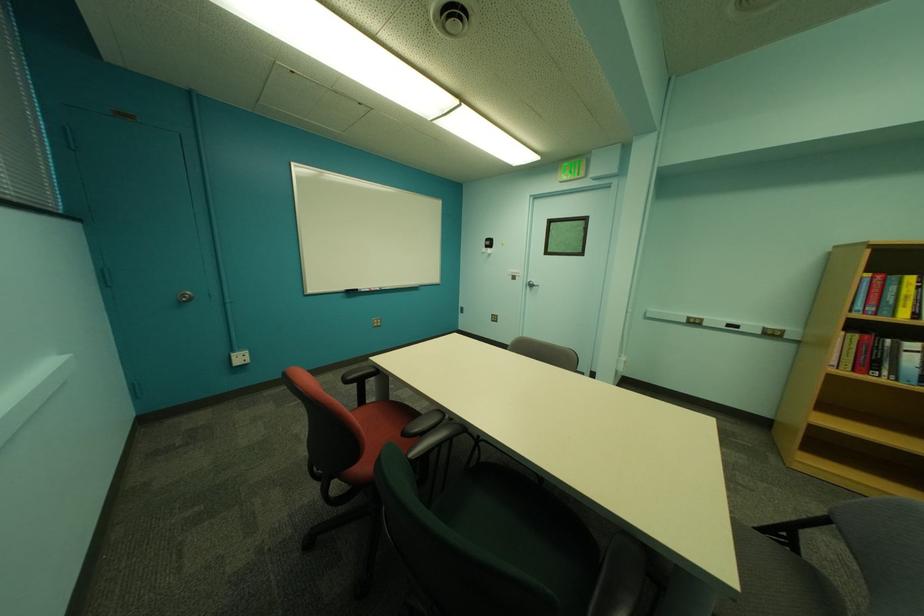
What do you see at coordinates (185, 296) in the screenshot? I see `the silver door knob` at bounding box center [185, 296].